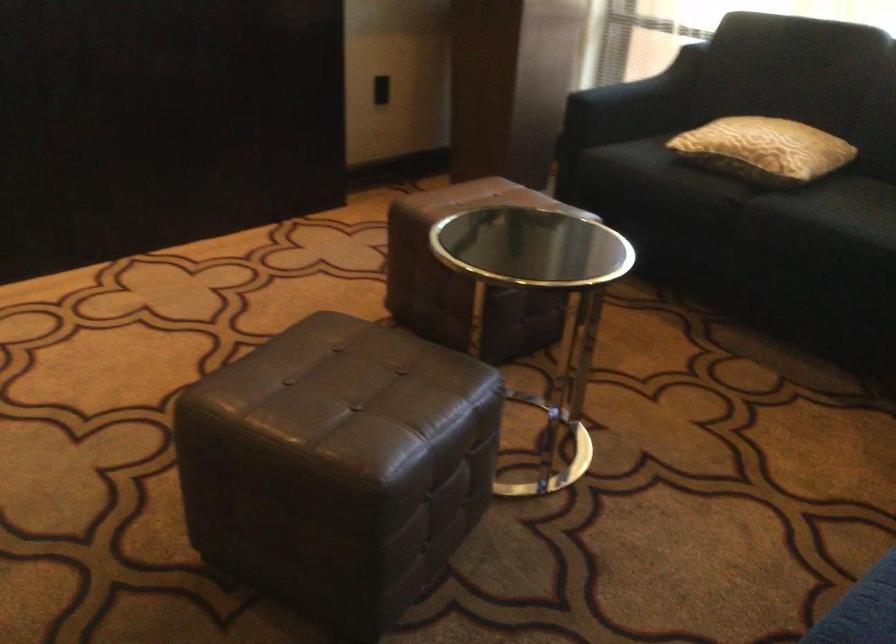
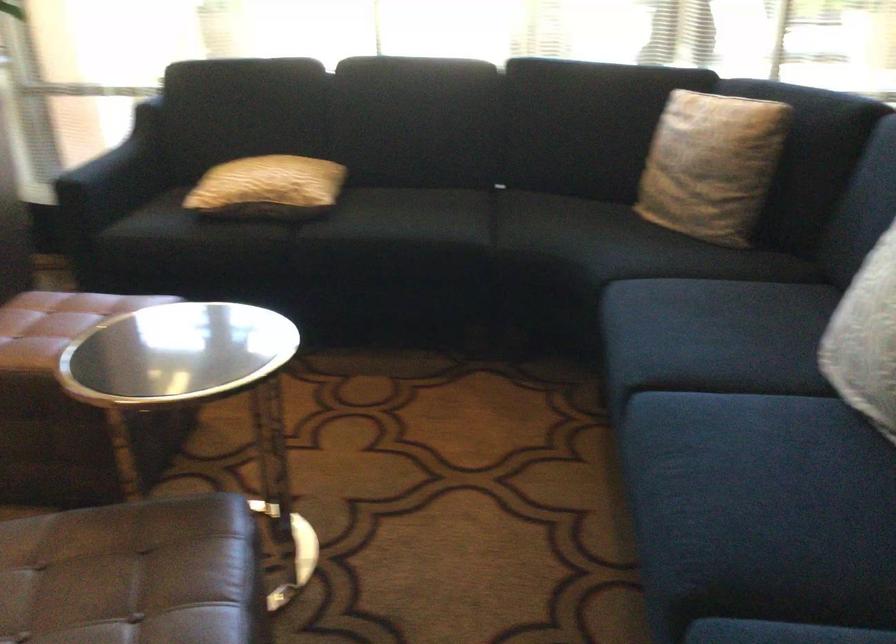
In the second image, find the point that corresponds to the point at 748,146 in the first image.

(268, 187)